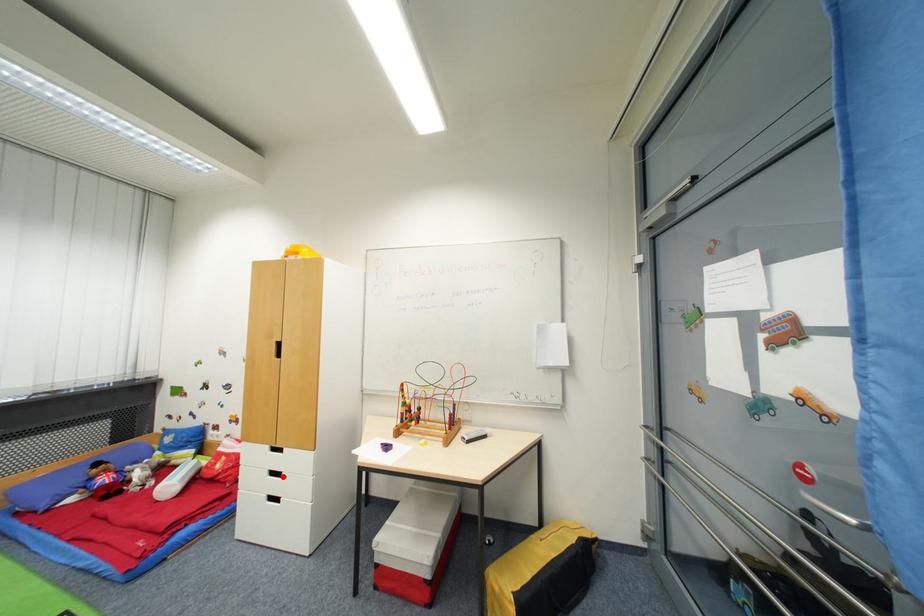
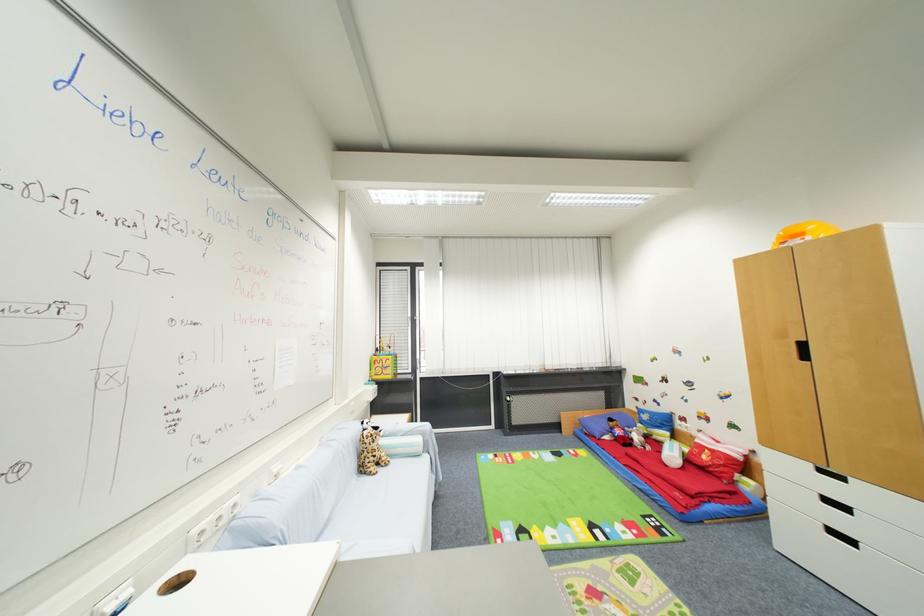
Question: I am providing you with two images of the same scene from different viewpoints. In image1, a red point is highlighted. Considering the same 3D point in image2, which of the following is correct?

Choices:
 (A) It is closer
 (B) It is farther

Answer: (A)